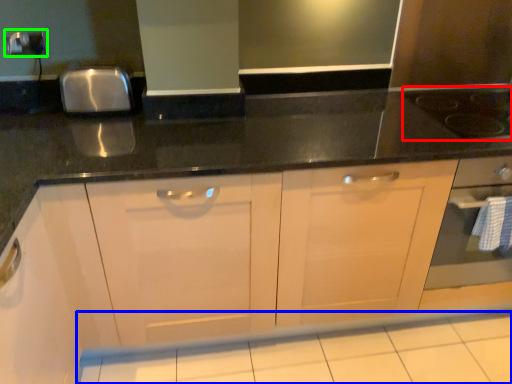
Question: Based on their relative distances, which object is farther from gas stove (highlighted by a red box)? Choose from tile (highlighted by a blue box) and electric outlet (highlighted by a green box).

Choices:
 (A) tile
 (B) electric outlet

Answer: (B)